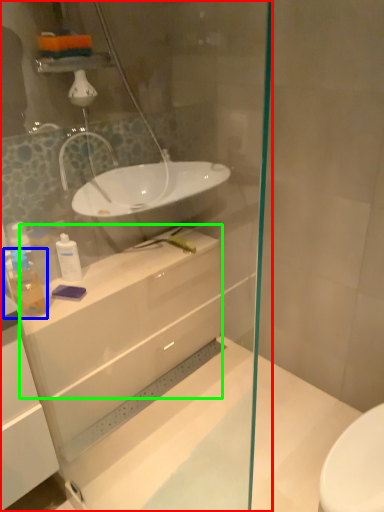
Question: Which is nearer to the shower door (highlighted by a red box)? toiletry (highlighted by a blue box) or counter top (highlighted by a green box).

Choices:
 (A) toiletry
 (B) counter top

Answer: (B)